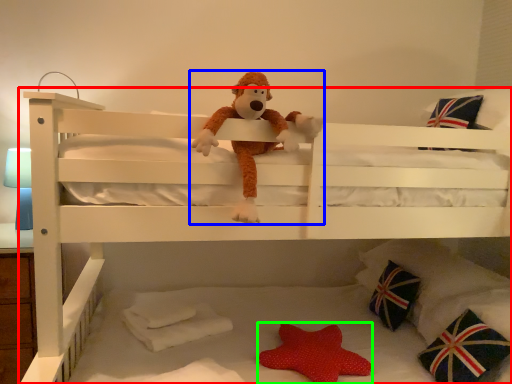
Question: Based on their relative distances, which object is farther from bed (highlighted by a red box)? Choose from toy (highlighted by a blue box) and toy (highlighted by a green box).

Choices:
 (A) toy
 (B) toy

Answer: (B)